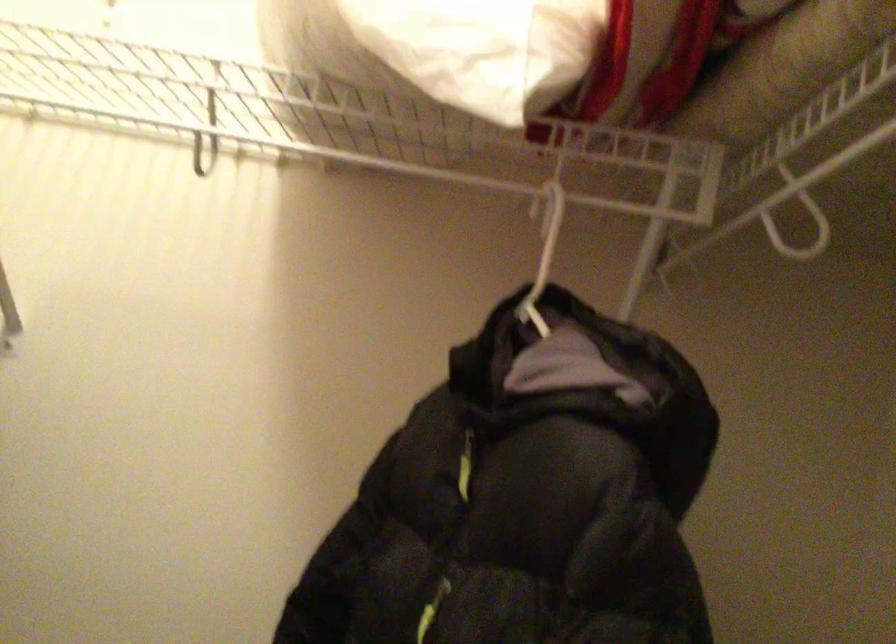
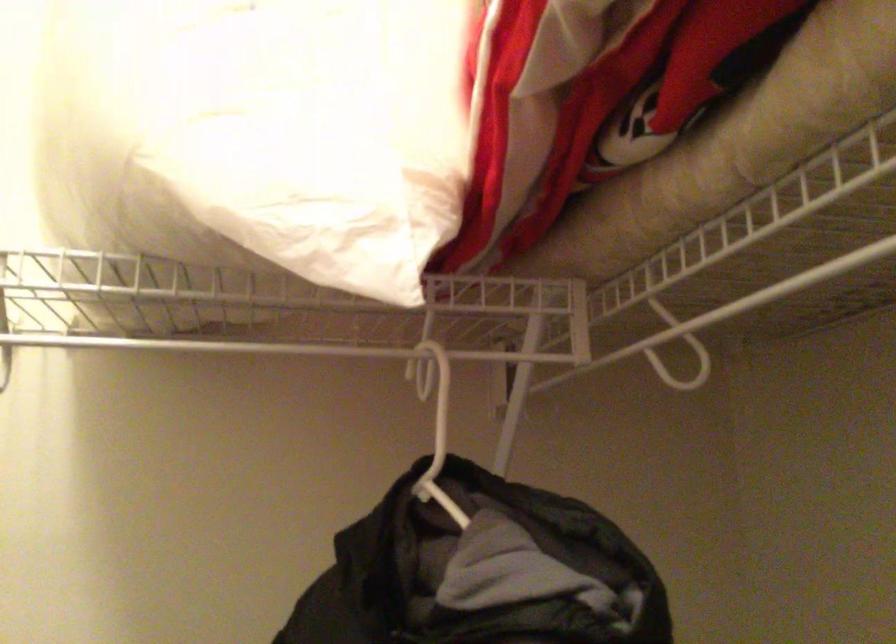
The point at [586,268] is marked in the first image. Where is the corresponding point in the second image?

(436, 404)